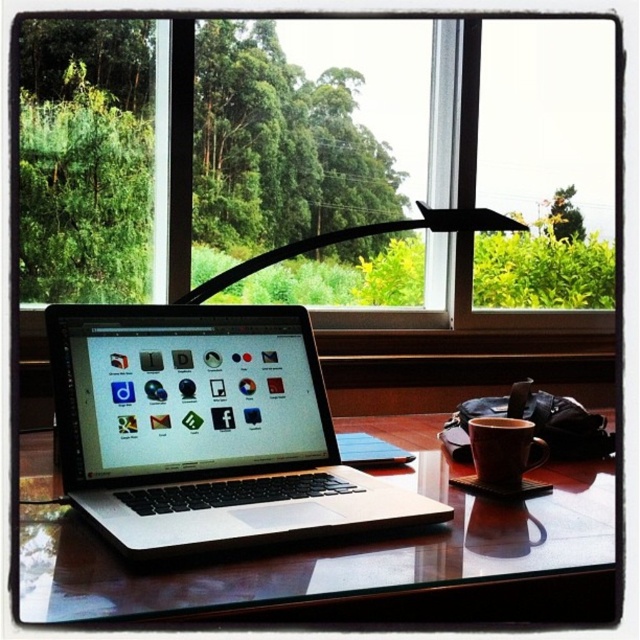
Who is positioned more to the right, black plastic lamp at center or matte ceramic mug at center?

matte ceramic mug at center is more to the right.

Can you confirm if black plastic lamp at center is bigger than matte ceramic mug at center?

Indeed, black plastic lamp at center has a larger size compared to matte ceramic mug at center.

Who is more forward, (385, 221) or (515, 449)?

Point (515, 449) is more forward.

Find the location of a particular element. This screenshot has width=640, height=640. black plastic lamp at center is located at coordinates (358, 237).

Is transparent glass window at center below silver/black laptop at center?

No, transparent glass window at center is not below silver/black laptop at center.

Does transparent glass window at center come in front of silver/black laptop at center?

No.

You are a GUI agent. You are given a task and a screenshot of the screen. Output one action in this format:
    pyautogui.click(x=<x>, y=<y>)
    Task: Click on the transparent glass window at center
    The image size is (640, 640).
    Given the screenshot: What is the action you would take?
    pyautogui.click(x=323, y=164)

The height and width of the screenshot is (640, 640). I want to click on transparent glass window at center, so click(323, 164).

Does transparent glass window at center have a greater width compared to matte ceramic mug at center?

Indeed, transparent glass window at center has a greater width compared to matte ceramic mug at center.

Between point (90, 241) and point (531, 467), which one is positioned behind?

Point (90, 241)

Where is `transparent glass window at center`? This screenshot has width=640, height=640. transparent glass window at center is located at coordinates (323, 164).